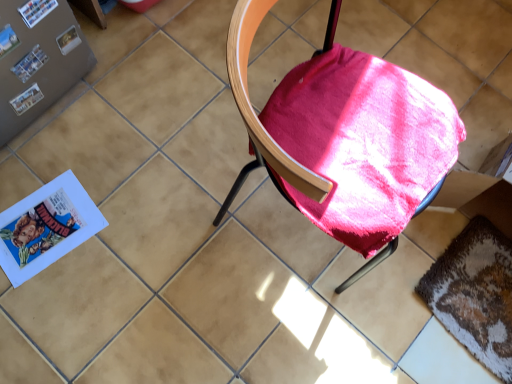
Identify the location of vacant space positioned to the left of textured brown mat at lower right. (384, 304).